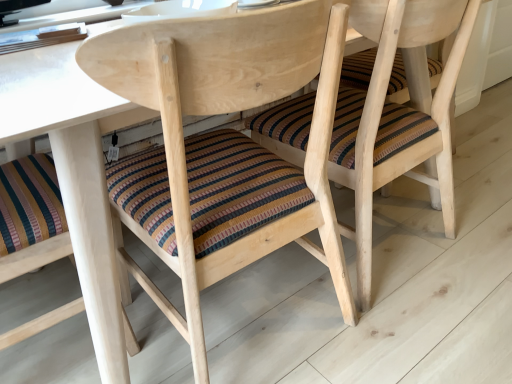
Where is `vacant space to the right of striped fabric cushion at center, marked as the first chair in a left-to-right arrangement`? The image size is (512, 384). vacant space to the right of striped fabric cushion at center, marked as the first chair in a left-to-right arrangement is located at coordinates (419, 328).